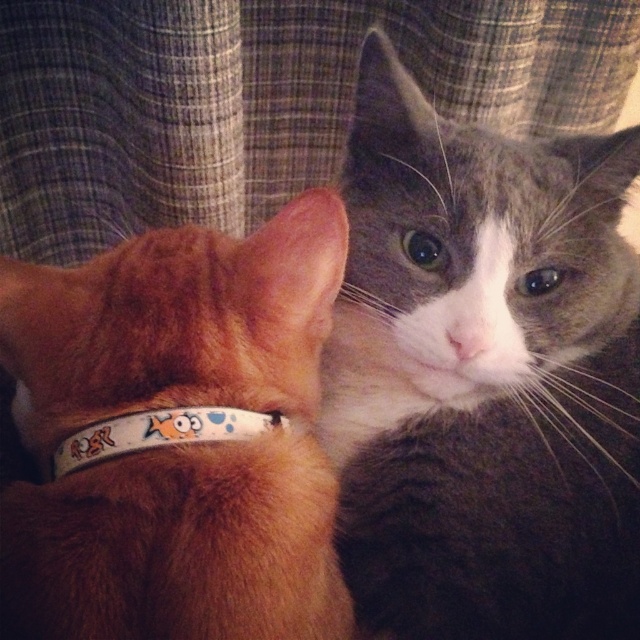
Question: Estimate the real-world distances between objects in this image. Which object is farther from the gray/white fur cat at center?

Choices:
 (A) orange fur cat at left
 (B) white plastic neckband at upper left

Answer: (B)

Question: Can you confirm if orange fur cat at left is bigger than white plastic neckband at upper left?

Choices:
 (A) yes
 (B) no

Answer: (A)

Question: Estimate the real-world distances between objects in this image. Which object is closer to the orange fur cat at left?

Choices:
 (A) gray/white fur cat at center
 (B) white plastic neckband at upper left

Answer: (B)

Question: Which of these objects is positioned closest to the white plastic neckband at upper left?

Choices:
 (A) orange fur cat at left
 (B) gray/white fur cat at center

Answer: (A)

Question: Is gray/white fur cat at center to the right of white plastic neckband at upper left from the viewer's perspective?

Choices:
 (A) no
 (B) yes

Answer: (B)

Question: Can you confirm if orange fur cat at left is smaller than white plastic neckband at upper left?

Choices:
 (A) no
 (B) yes

Answer: (A)